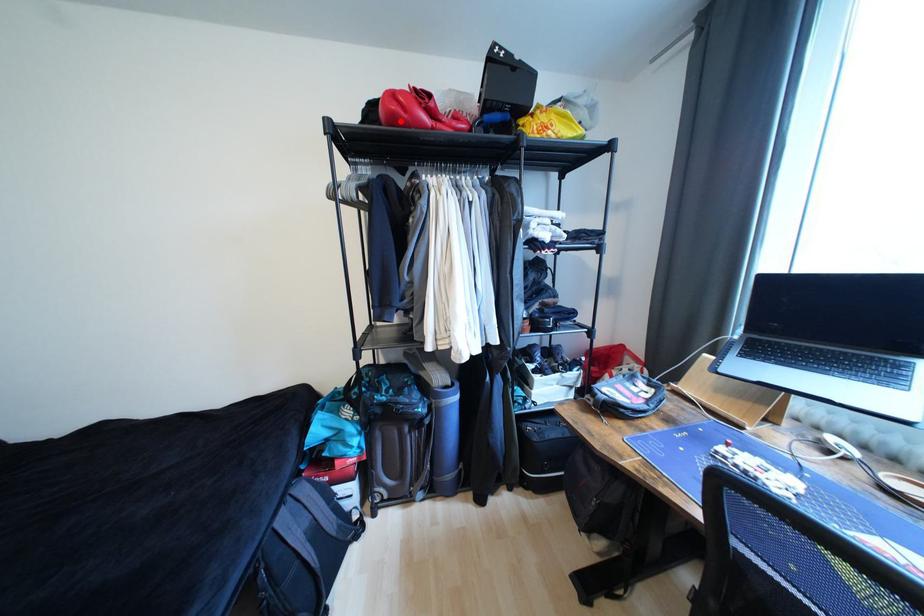
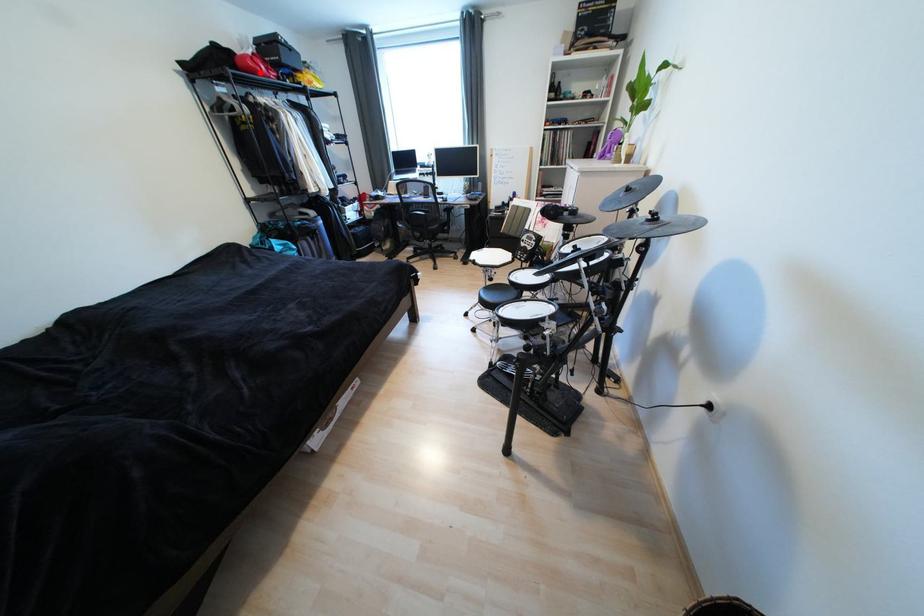
I am providing you with two images of the same scene from different viewpoints. A red point is marked on the first image and another point is marked on the second image. Is the marked point in image1 the same physical position as the marked point in image2?

Yes